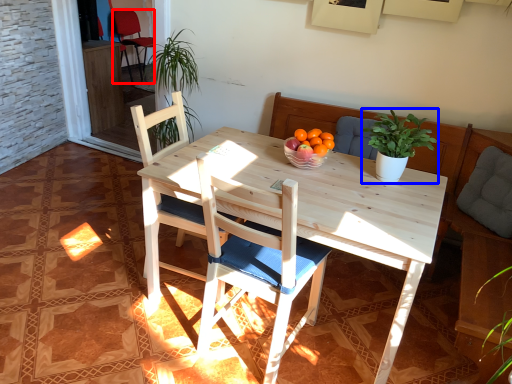
Question: Which object appears closest to the camera in this image, chair (highlighted by a red box) or houseplant (highlighted by a blue box)?

Choices:
 (A) chair
 (B) houseplant

Answer: (B)